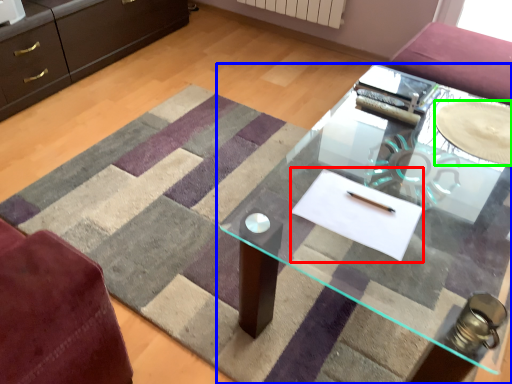
Question: Which object is positioned farthest from flat (highlighted by a red box)? Select from table (highlighted by a blue box) and glass plate (highlighted by a green box).

Choices:
 (A) table
 (B) glass plate

Answer: (A)